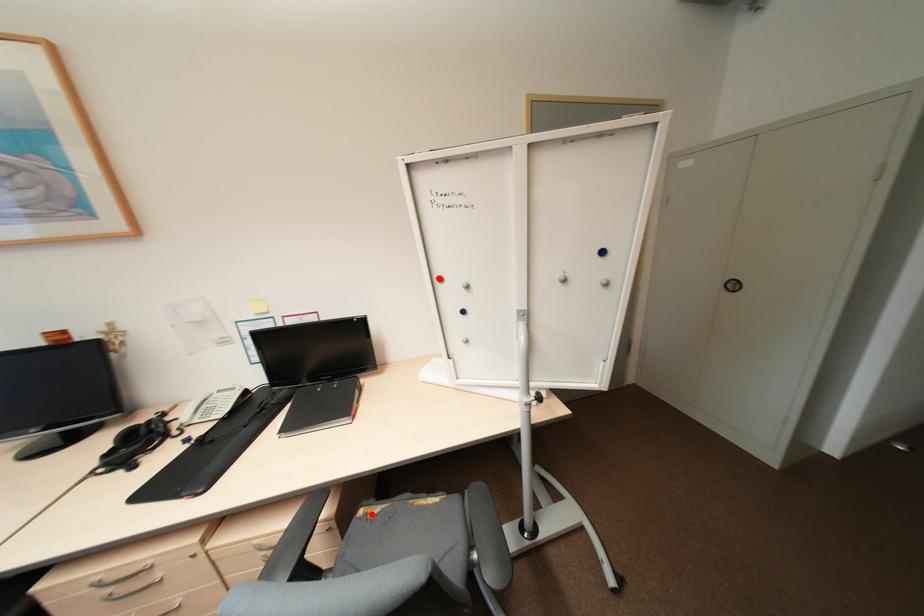
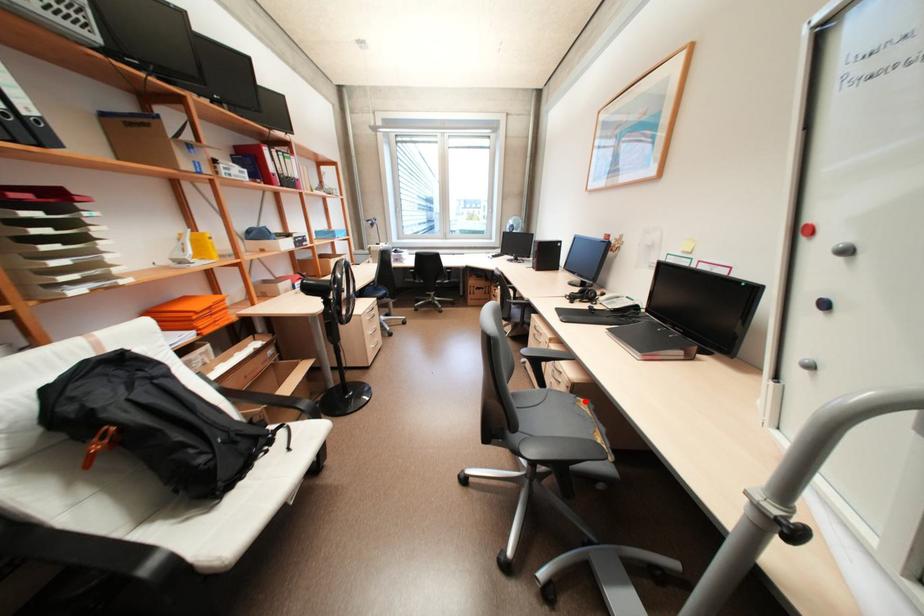
Consider the image. I am providing you with two images of the same scene from different viewpoints. A red point is marked on the first image and another point is marked on the second image. Are the points marked in image1 and image2 representing the same 3D position?

Yes